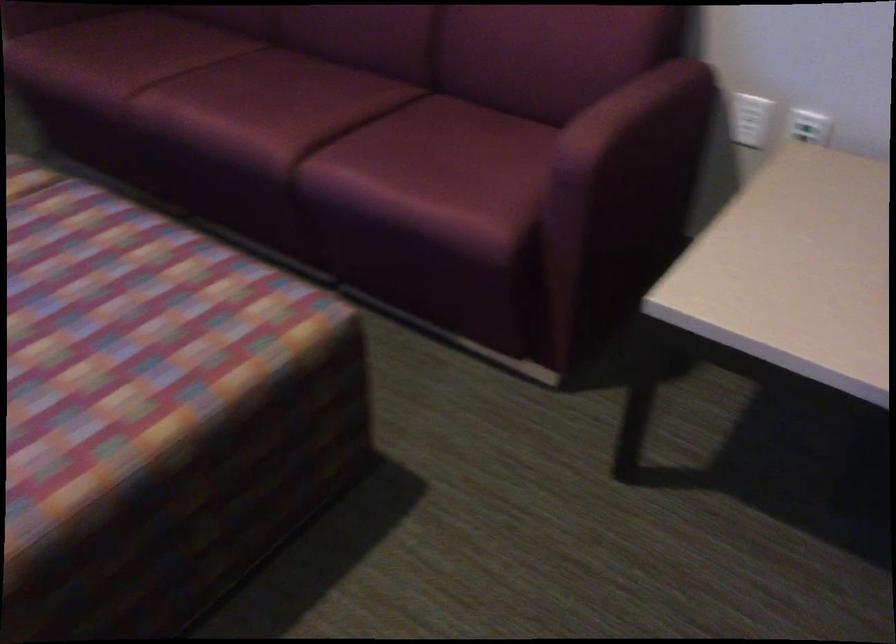
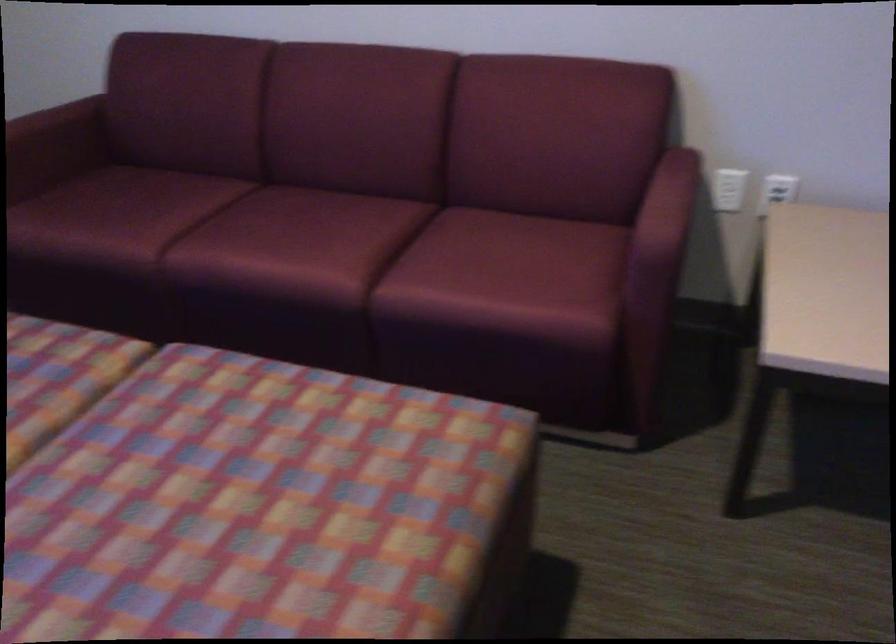
Where in the second image is the point corresponding to pixel 803 131 from the first image?

(777, 190)